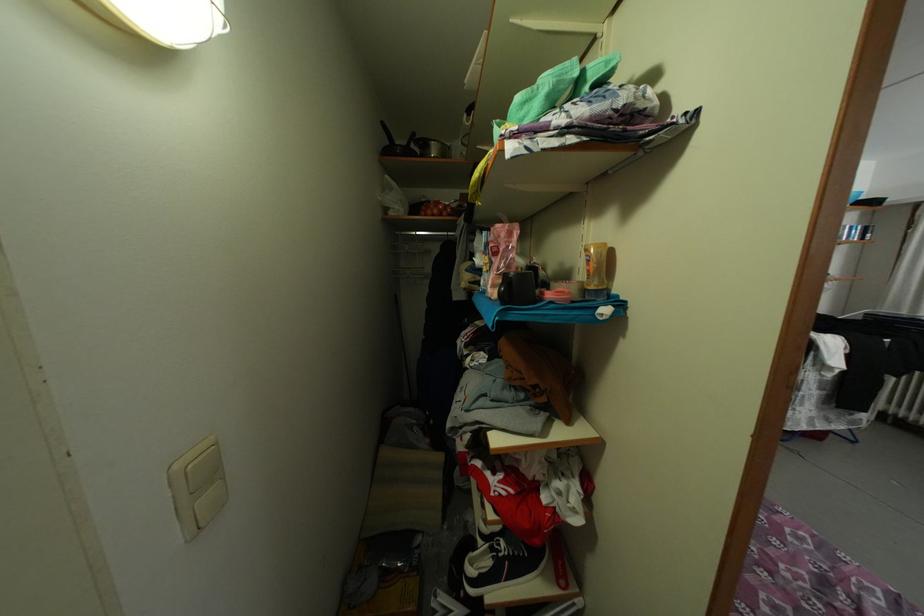
What do you see at coordinates (417, 142) in the screenshot? This screenshot has width=924, height=616. I see `the black mug handle` at bounding box center [417, 142].